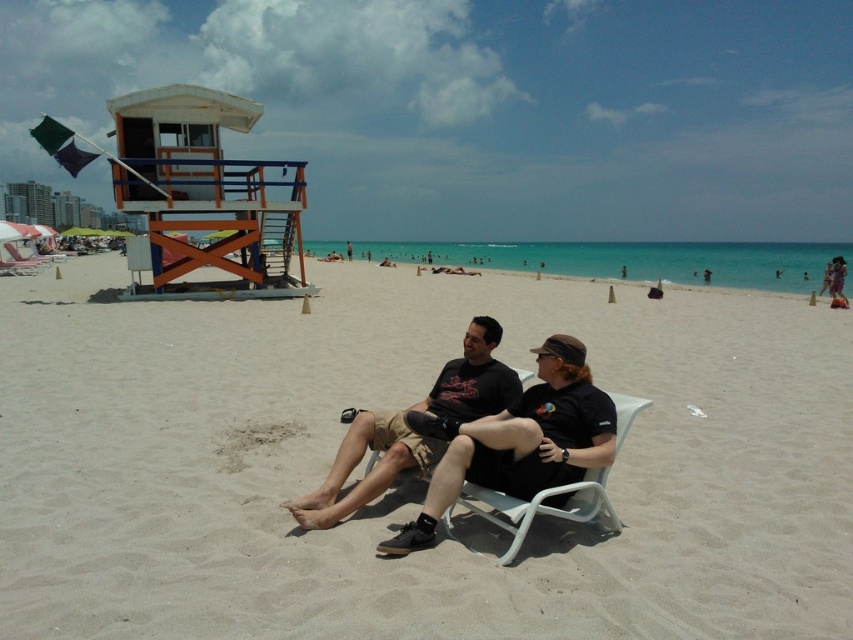
Between light beige sand at center and matte black shirt at center, which one is positioned lower?

matte black shirt at center is lower down.

Does point (99, 497) come in front of point (483, 320)?

Yes, it is in front of point (483, 320).

Locate an element on the screen. Image resolution: width=853 pixels, height=640 pixels. light beige sand at center is located at coordinates (408, 484).

Is point (376, 548) closer to viewer compared to point (347, 472)?

Yes.

Where is `black fabric shirt at center`? This screenshot has height=640, width=853. black fabric shirt at center is located at coordinates (520, 442).

Is black fabric shirt at center thinner than matte black sunglasses at upper right?

Correct, black fabric shirt at center's width is less than matte black sunglasses at upper right's.

Identify the location of black fabric shirt at center. (520, 442).

Find the location of a particular element. This screenshot has height=640, width=853. black fabric shirt at center is located at coordinates (520, 442).